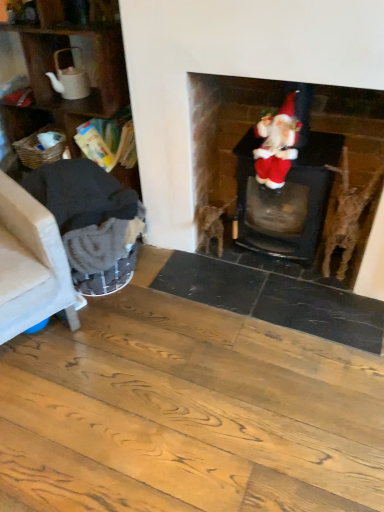
Question: Does velvet santa at center have a lesser height compared to wooden textured shelf at left?

Choices:
 (A) yes
 (B) no

Answer: (A)

Question: Can you confirm if velvet santa at center is bigger than wooden textured shelf at left?

Choices:
 (A) yes
 (B) no

Answer: (B)

Question: Considering the relative sizes of velvet santa at center and wooden textured shelf at left in the image provided, is velvet santa at center wider than wooden textured shelf at left?

Choices:
 (A) no
 (B) yes

Answer: (A)

Question: Does velvet santa at center contain wooden textured shelf at left?

Choices:
 (A) no
 (B) yes

Answer: (A)

Question: Is velvet santa at center at the right side of wooden textured shelf at left?

Choices:
 (A) no
 (B) yes

Answer: (B)

Question: Is velvet santa at center further to camera compared to wooden textured shelf at left?

Choices:
 (A) no
 (B) yes

Answer: (A)

Question: Can you see beige fabric armchair at left, acting as the first armchair starting from the left, touching velvet santa at upper right?

Choices:
 (A) no
 (B) yes

Answer: (A)

Question: Can we say beige fabric armchair at left, placed as the 2th armchair when sorted from right to left, lies outside velvet santa at upper right?

Choices:
 (A) yes
 (B) no

Answer: (A)

Question: Is beige fabric armchair at left, placed as the 2th armchair when sorted from right to left, wider than velvet santa at upper right?

Choices:
 (A) yes
 (B) no

Answer: (A)

Question: From a real-world perspective, is beige fabric armchair at left, placed as the 2th armchair when sorted from right to left, physically below velvet santa at upper right?

Choices:
 (A) no
 (B) yes

Answer: (B)

Question: From the image's perspective, is beige fabric armchair at left, acting as the first armchair starting from the left, beneath velvet santa at upper right?

Choices:
 (A) no
 (B) yes

Answer: (B)

Question: Does beige fabric armchair at left, placed as the 2th armchair when sorted from right to left, contain velvet santa at upper right?

Choices:
 (A) no
 (B) yes

Answer: (A)

Question: Does dark gray fabric armchair at left, which is the first armchair from right to left, have a smaller size compared to beige fabric armchair at left, acting as the first armchair starting from the left?

Choices:
 (A) no
 (B) yes

Answer: (B)